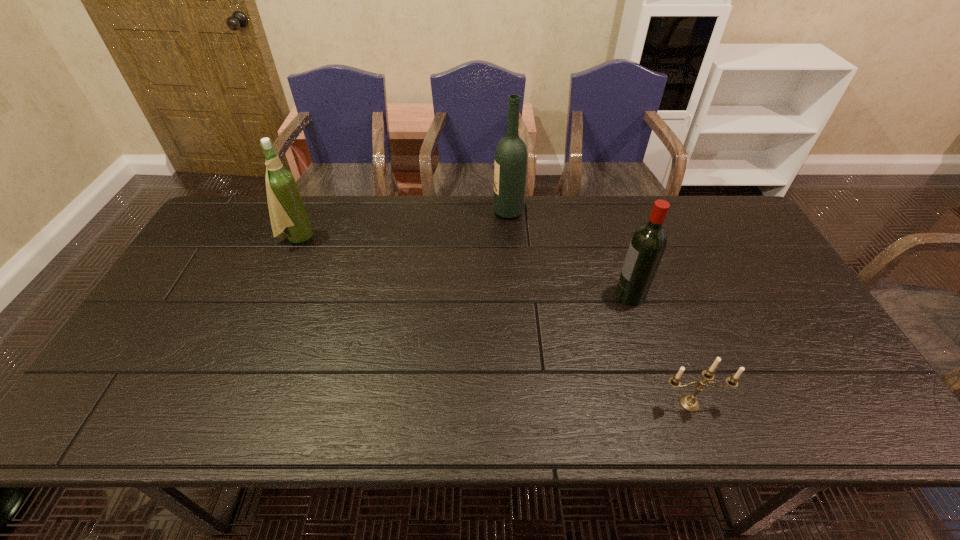
Identify the location of blank space at the right edge of the desktop. The width and height of the screenshot is (960, 540). (777, 294).

The height and width of the screenshot is (540, 960). What are the coordinates of `free space at the far right corner` in the screenshot? It's located at (699, 224).

Where is `vacant space that is in between the second farthest wine bottle and the farthest object`? The image size is (960, 540). vacant space that is in between the second farthest wine bottle and the farthest object is located at coordinates (402, 225).

You are a GUI agent. You are given a task and a screenshot of the screen. Output one action in this format:
    pyautogui.click(x=<x>, y=<y>)
    Task: Click on the free spot between the second wine bottle from left to right and the leftmost wine bottle
    The width and height of the screenshot is (960, 540).
    Given the screenshot: What is the action you would take?
    pyautogui.click(x=402, y=225)

The width and height of the screenshot is (960, 540). I want to click on empty space between the shortest object and the third farthest object, so click(x=660, y=349).

Find the location of a particular element. The width and height of the screenshot is (960, 540). free space between the second wine bottle from right to left and the second farthest wine bottle is located at coordinates (402, 225).

Identify the location of vacant space that's between the nearest object and the nearest wine bottle. (660, 349).

At what (x,y) coordinates should I click in order to perform the action: click on vacant area between the candle and the rightmost wine bottle. Please return your answer as a coordinate pair (x, y). Looking at the image, I should click on click(x=660, y=349).

Locate an element on the screen. The width and height of the screenshot is (960, 540). vacant area that lies between the shortest object and the second nearest object is located at coordinates (660, 349).

Where is `vacant point located between the second wine bottle from right to left and the nearest wine bottle`? The width and height of the screenshot is (960, 540). vacant point located between the second wine bottle from right to left and the nearest wine bottle is located at coordinates (569, 253).